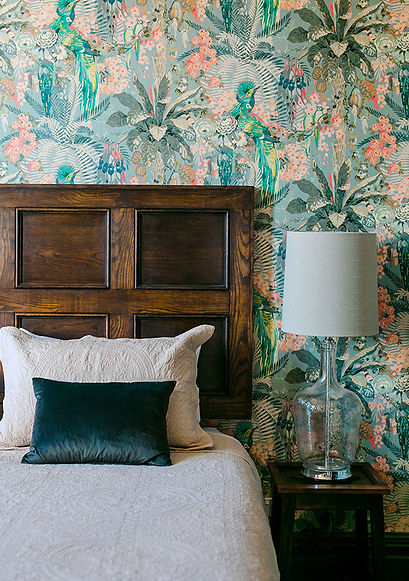
Locate an element on the screen. The image size is (409, 581). wall is located at coordinates (370, 365).